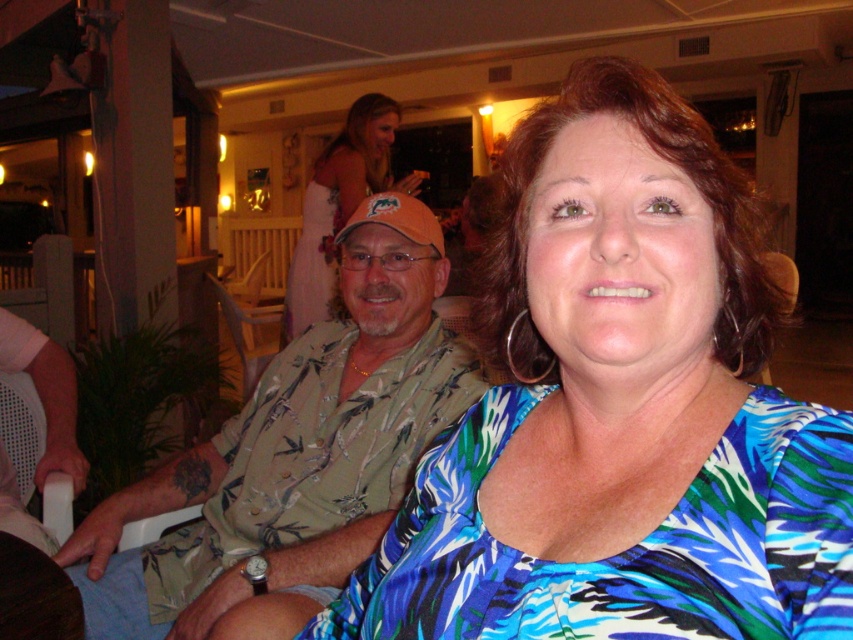
Does green floral shirt at left have a greater width compared to matte orange cap at center?

Yes, green floral shirt at left is wider than matte orange cap at center.

Who is more forward, [314,426] or [294,289]?

Point [314,426]

At what (x,y) coordinates should I click in order to perform the action: click on green floral shirt at left. Please return your answer as a coordinate pair (x, y). Image resolution: width=853 pixels, height=640 pixels. Looking at the image, I should click on (294, 451).

Between blue printed blouse at center and matte orange cap at center, which one is positioned higher?

matte orange cap at center

Can you confirm if blue printed blouse at center is thinner than matte orange cap at center?

Yes, blue printed blouse at center is thinner than matte orange cap at center.

Locate an element on the screen. blue printed blouse at center is located at coordinates (619, 410).

Is point (608, 296) closer to camera compared to point (383, 424)?

Yes, point (608, 296) is in front of point (383, 424).

Which is below, blue printed blouse at center or green floral shirt at left?

green floral shirt at left is below.

What do you see at coordinates (619, 410) in the screenshot?
I see `blue printed blouse at center` at bounding box center [619, 410].

I want to click on blue printed blouse at center, so click(619, 410).